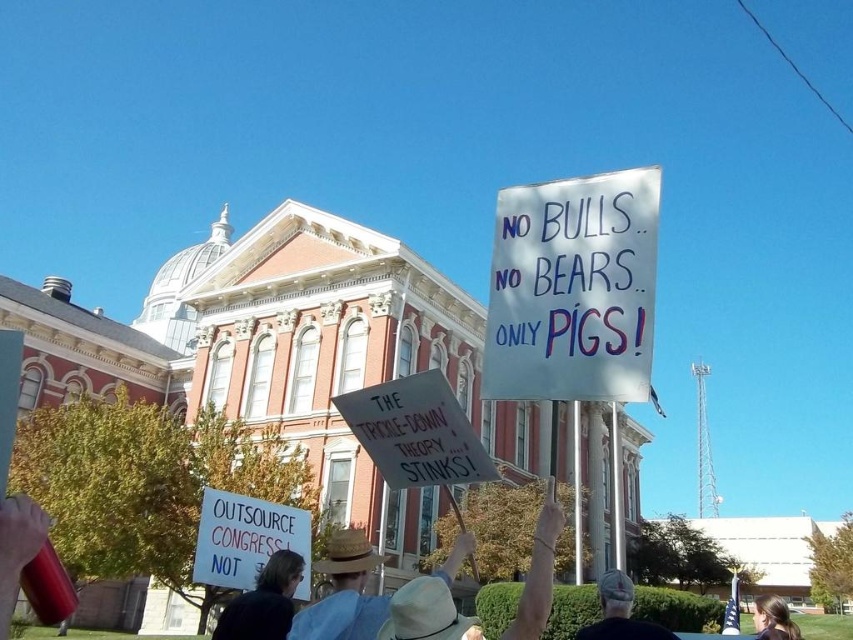
Question: Which of these objects is positioned farthest from the smooth brown hair at center?

Choices:
 (A) straw hat at center
 (B) white paper sign at center
 (C) dark brown leather jacket at lower center
 (D) denim cap at center

Answer: (C)

Question: Among these points, which one is farthest from the camera?

Choices:
 (A) (552, 564)
 (B) (370, 608)
 (C) (254, 584)

Answer: (C)

Question: Does straw hat at center have a greater width compared to denim cap at center?

Choices:
 (A) yes
 (B) no

Answer: (B)

Question: Can you confirm if denim cap at center is positioned to the right of smooth brown hair at center?

Choices:
 (A) yes
 (B) no

Answer: (B)

Question: Does denim cap at center appear under smooth brown hair at center?

Choices:
 (A) yes
 (B) no

Answer: (B)

Question: Which point is closer to the camera taking this photo?

Choices:
 (A) (642, 628)
 (B) (372, 604)

Answer: (B)